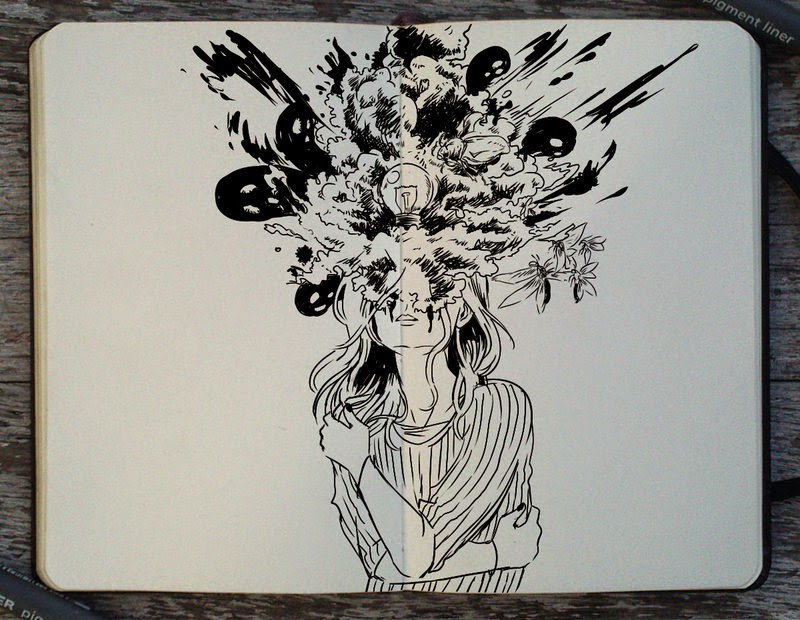
I want to click on pen container, so click(x=20, y=588).